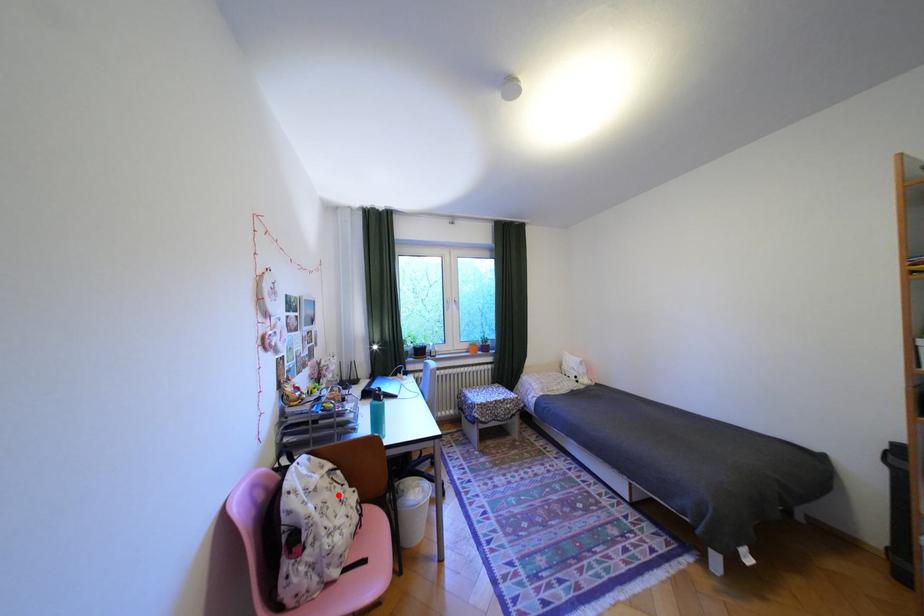
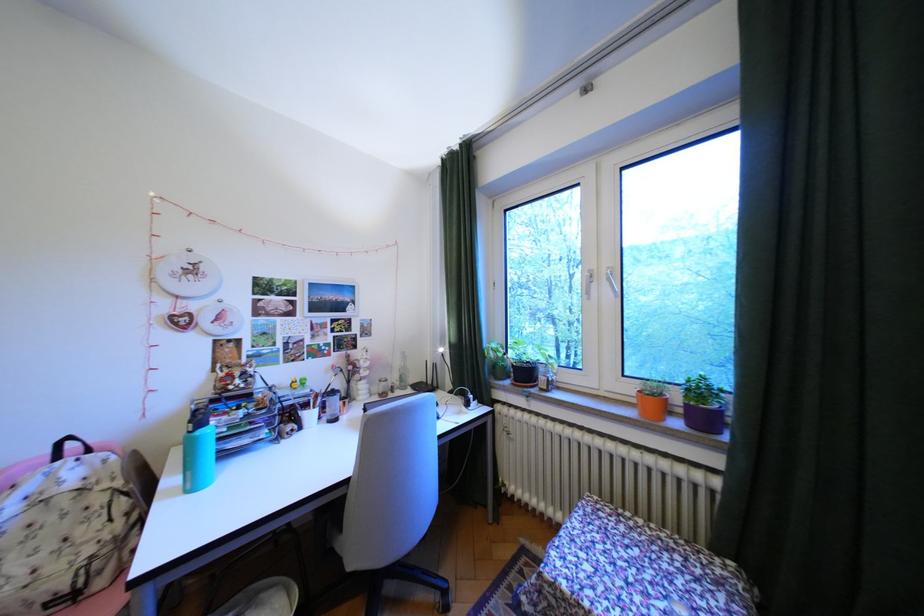
Find the pixel in the second image that matches the highlighted location in the first image.

(65, 519)